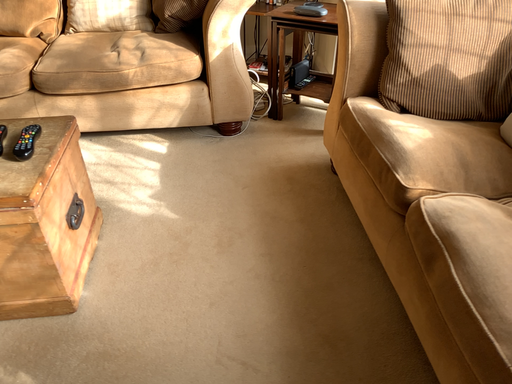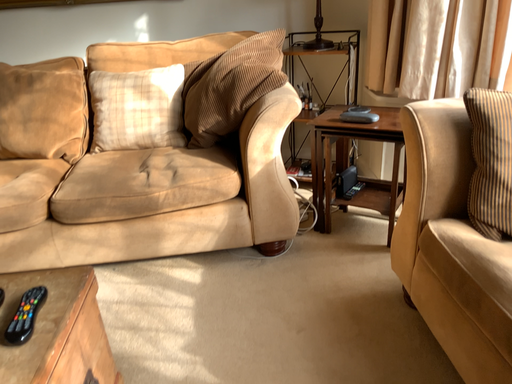
Question: How did the camera likely rotate when shooting the video?

Choices:
 (A) rotated downward
 (B) rotated upward

Answer: (B)